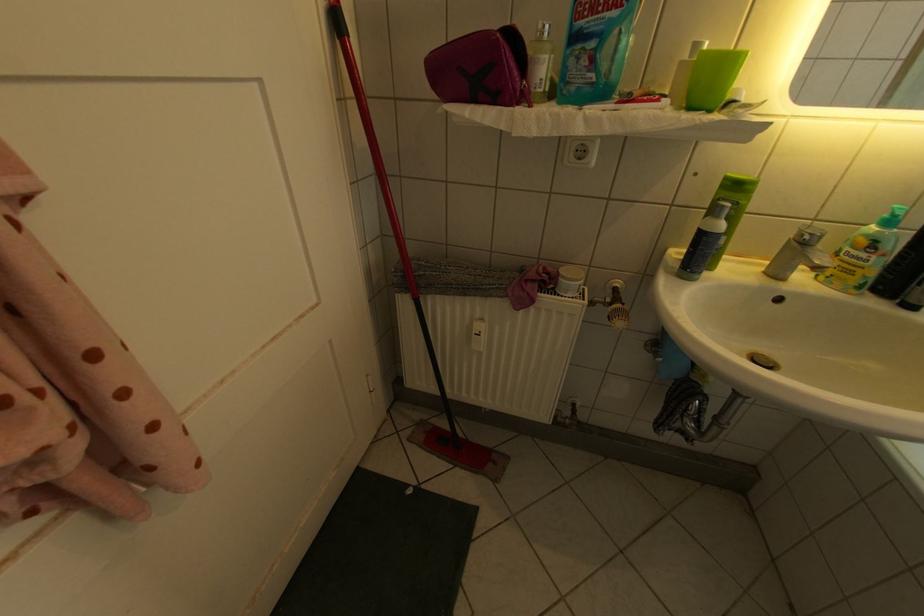
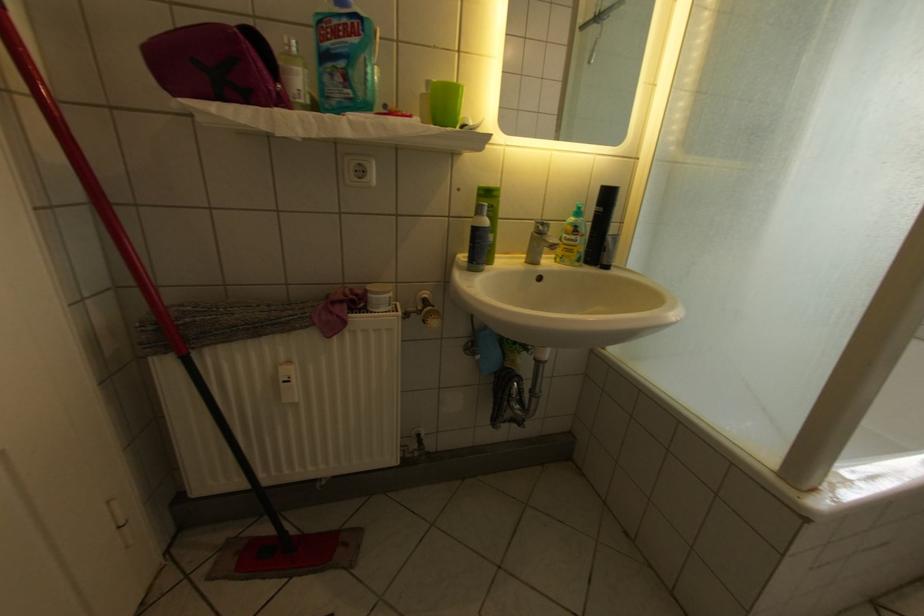
The point at (x=774, y=270) is marked in the first image. Where is the corresponding point in the second image?

(536, 262)